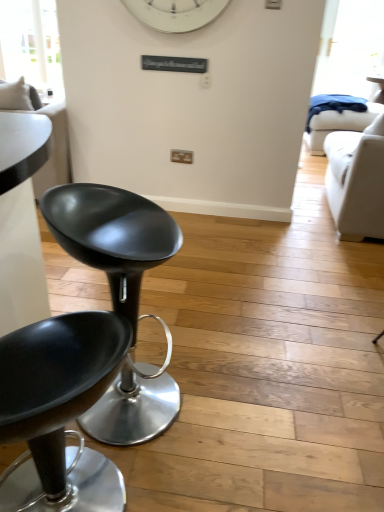
Question: From a real-world perspective, is matte black stool at left, positioned as the first chair in front-to-back order, over white fabric couch at left?

Choices:
 (A) no
 (B) yes

Answer: (A)

Question: Is matte black stool at left, acting as the 2th chair starting from the back, not within white fabric couch at left?

Choices:
 (A) no
 (B) yes

Answer: (B)

Question: Considering the relative sizes of matte black stool at left, acting as the 2th chair starting from the back, and white fabric couch at left in the image provided, is matte black stool at left, acting as the 2th chair starting from the back, thinner than white fabric couch at left?

Choices:
 (A) yes
 (B) no

Answer: (A)

Question: From the image's perspective, does matte black stool at left, acting as the 2th chair starting from the back, appear higher than white fabric couch at left?

Choices:
 (A) yes
 (B) no

Answer: (B)

Question: Is white fabric couch at left completely or partially inside matte black stool at left, acting as the 2th chair starting from the back?

Choices:
 (A) yes
 (B) no

Answer: (B)

Question: Is matte black stool at left, acting as the 2th chair starting from the back, wider or thinner than white fabric couch at left?

Choices:
 (A) wide
 (B) thin

Answer: (B)

Question: From the image's perspective, is matte black stool at left, acting as the 2th chair starting from the back, above or below white fabric couch at left?

Choices:
 (A) above
 (B) below

Answer: (B)

Question: From a real-world perspective, is matte black stool at left, positioned as the first chair in front-to-back order, above or below white fabric couch at left?

Choices:
 (A) above
 (B) below

Answer: (B)

Question: Is matte black stool at left, acting as the 2th chair starting from the back, to the left or to the right of white fabric couch at left in the image?

Choices:
 (A) right
 (B) left

Answer: (A)

Question: Considering the positions of point (3, 110) and point (21, 26), is point (3, 110) closer or farther from the camera than point (21, 26)?

Choices:
 (A) farther
 (B) closer

Answer: (B)

Question: Considering their positions, is white fabric couch at left located in front of or behind transparent glass window at upper left?

Choices:
 (A) behind
 (B) front

Answer: (B)

Question: From the image's perspective, relative to transparent glass window at upper left, is white fabric couch at left above or below?

Choices:
 (A) below
 (B) above

Answer: (A)

Question: Considering the positions of white fabric couch at left and transparent glass window at upper left in the image, is white fabric couch at left bigger or smaller than transparent glass window at upper left?

Choices:
 (A) small
 (B) big

Answer: (B)

Question: From the image's perspective, is transparent glass window at upper left positioned above or below matte black stool at left, arranged as the 2th chair when viewed from the front?

Choices:
 (A) above
 (B) below

Answer: (A)

Question: Visually, is transparent glass window at upper left positioned to the left or to the right of matte black stool at left, arranged as the 2th chair when viewed from the front?

Choices:
 (A) right
 (B) left

Answer: (B)